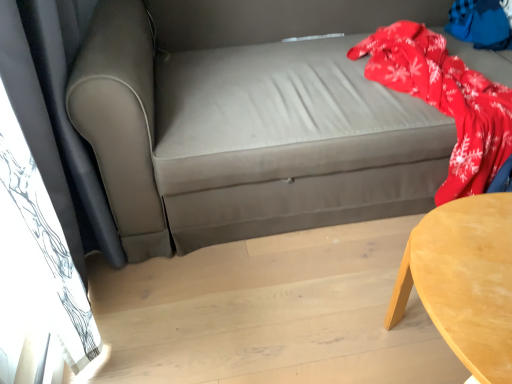
Where is `red fleece blanket at upper right`? This screenshot has width=512, height=384. red fleece blanket at upper right is located at coordinates (480, 24).

The width and height of the screenshot is (512, 384). In order to click on matte gray couch at center in this screenshot , I will do `click(250, 119)`.

Is red fleece blanket at upper right further to the viewer compared to matte gray couch at center?

That is True.

Find the location of a particular element. This screenshot has height=384, width=512. studio couch in front of the red fleece blanket at upper right is located at coordinates (250, 119).

Can you tell me how much red fleece blanket at upper right and matte gray couch at center differ in facing direction?

There is a 1.98-degree angle between the facing directions of red fleece blanket at upper right and matte gray couch at center.

Is there a large distance between red fleece blanket at upper right and matte gray couch at center?

red fleece blanket at upper right is actually quite close to matte gray couch at center.

Which object is positioned more to the right, red fleece blanket at upper right or red fleece blanket at upper right?

red fleece blanket at upper right is more to the right.

From a real-world perspective, does red fleece blanket at upper right sit lower than red fleece blanket at upper right?

Correct, in the physical world, red fleece blanket at upper right is lower than red fleece blanket at upper right.

Does red fleece blanket at upper right have a lesser height compared to red fleece blanket at upper right?

In fact, red fleece blanket at upper right may be taller than red fleece blanket at upper right.

How many degrees apart are the facing directions of red fleece blanket at upper right and red fleece blanket at upper right?

2.08 degrees separate the facing orientations of red fleece blanket at upper right and red fleece blanket at upper right.

Is red fleece blanket at upper right positioned beyond the bounds of red fleece blanket at upper right?

Actually, red fleece blanket at upper right is within red fleece blanket at upper right.

Does red fleece blanket at upper right come behind red fleece blanket at upper right?

Yes, red fleece blanket at upper right is further from the camera.

Does point (466, 4) come in front of point (383, 51)?

No, it is behind (383, 51).

Is light wood table at lower right facing away from red fleece blanket at upper right?

Yes, red fleece blanket at upper right is at the back of light wood table at lower right.

Would you say light wood table at lower right is inside or outside red fleece blanket at upper right?

light wood table at lower right is not inside red fleece blanket at upper right, it's outside.

At what (x,y) coordinates should I click in order to perform the action: click on table below the red fleece blanket at upper right (from a real-world perspective). Please return your answer as a coordinate pair (x, y). This screenshot has height=384, width=512. Looking at the image, I should click on (464, 281).

Which is more to the left, light wood table at lower right or red fleece blanket at upper right?

light wood table at lower right.

Is light wood table at lower right positioned with its back to matte gray couch at center?

Absolutely, light wood table at lower right is directed away from matte gray couch at center.

In the scene shown: How far apart are light wood table at lower right and matte gray couch at center?

They are 66.78 centimeters apart.

From the image's perspective, would you say light wood table at lower right is shown under matte gray couch at center?

Yes, from the image's perspective, light wood table at lower right is beneath matte gray couch at center.

Which of these two, light wood table at lower right or matte gray couch at center, is thinner?

With smaller width is light wood table at lower right.

From a real-world perspective, which object rests below the other?

From a 3D spatial view, light wood table at lower right is below.

Is red fleece blanket at upper right at the left side of light wood table at lower right?

Incorrect, red fleece blanket at upper right is not on the left side of light wood table at lower right.

Is red fleece blanket at upper right not near light wood table at lower right?

Yes, red fleece blanket at upper right and light wood table at lower right are quite far apart.

From the image's perspective, is matte gray couch at center below red fleece blanket at upper right?

Yes, from the image's perspective, matte gray couch at center is below red fleece blanket at upper right.

In terms of size, does matte gray couch at center appear bigger or smaller than red fleece blanket at upper right?

Considering their sizes, matte gray couch at center takes up more space than red fleece blanket at upper right.

Is red fleece blanket at upper right surrounded by matte gray couch at center?

Indeed, red fleece blanket at upper right is located within matte gray couch at center.

Locate an element on the screen. blanket below the matte gray couch at center (from a real-world perspective) is located at coordinates (445, 100).

This screenshot has height=384, width=512. In the image, there is a red fleece blanket at upper right. Identify the location of blanket below it (from the image's perspective). (445, 100).

Which object lies further to the anchor point red fleece blanket at upper right, red fleece blanket at upper right or matte gray couch at center?

The object further to red fleece blanket at upper right is matte gray couch at center.

Based on their spatial positions, is red fleece blanket at upper right or matte gray couch at center further from red fleece blanket at upper right?

red fleece blanket at upper right.

When comparing their distances from red fleece blanket at upper right, does red fleece blanket at upper right or light wood table at lower right seem closer?

red fleece blanket at upper right is closer to red fleece blanket at upper right.

Considering their positions, is matte gray couch at center positioned further to light wood table at lower right than red fleece blanket at upper right?

The object further to light wood table at lower right is matte gray couch at center.

Looking at the image, which one is located further to red fleece blanket at upper right, matte gray couch at center or red fleece blanket at upper right?

red fleece blanket at upper right is further to red fleece blanket at upper right.

Estimate the real-world distances between objects in this image. Which object is closer to matte gray couch at center, red fleece blanket at upper right or light wood table at lower right?

red fleece blanket at upper right is closer to matte gray couch at center.

Looking at the image, which one is located closer to light wood table at lower right, red fleece blanket at upper right or matte gray couch at center?

matte gray couch at center lies closer to light wood table at lower right than the other object.

Estimate the real-world distances between objects in this image. Which object is closer to matte gray couch at center, light wood table at lower right or red fleece blanket at upper right?

light wood table at lower right lies closer to matte gray couch at center than the other object.

At what (x,y) coordinates should I click in order to perform the action: click on blanket between red fleece blanket at upper right and light wood table at lower right vertically. Please return your answer as a coordinate pair (x, y). This screenshot has width=512, height=384. Looking at the image, I should click on (445, 100).

I want to click on studio couch between red fleece blanket at upper right and light wood table at lower right in the up-down direction, so click(x=250, y=119).

Where is `blanket between matte gray couch at center and red fleece blanket at upper right from front to back`? The image size is (512, 384). blanket between matte gray couch at center and red fleece blanket at upper right from front to back is located at coordinates (445, 100).

Locate an element on the screen. This screenshot has height=384, width=512. studio couch between red fleece blanket at upper right and light wood table at lower right from top to bottom is located at coordinates (250, 119).